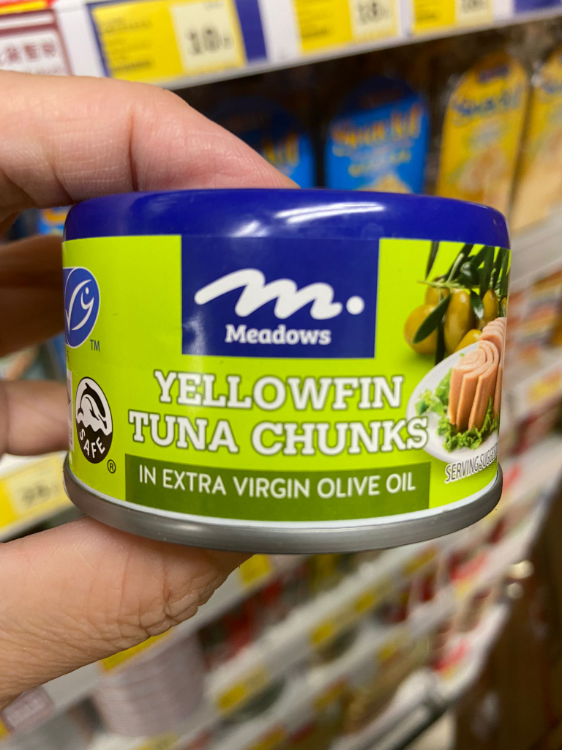
This screenshot has height=750, width=562. In order to click on plate in this screenshot , I will do `click(439, 451)`.